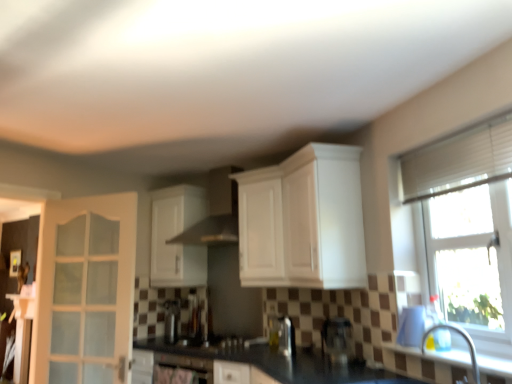
Question: Is black granite countertop at center surrounded by silver metallic faucet at lower right?

Choices:
 (A) no
 (B) yes

Answer: (A)

Question: Does silver metallic faucet at lower right have a larger size compared to black granite countertop at center?

Choices:
 (A) no
 (B) yes

Answer: (A)

Question: Is silver metallic faucet at lower right not inside black granite countertop at center?

Choices:
 (A) no
 (B) yes

Answer: (B)

Question: Is silver metallic faucet at lower right facing away from black granite countertop at center?

Choices:
 (A) yes
 (B) no

Answer: (B)

Question: Does silver metallic faucet at lower right lie behind black granite countertop at center?

Choices:
 (A) no
 (B) yes

Answer: (B)

Question: Choose the correct answer: Is black granite countertop at center inside white glass door at left or outside it?

Choices:
 (A) inside
 (B) outside

Answer: (B)

Question: In terms of width, does black granite countertop at center look wider or thinner when compared to white glass door at left?

Choices:
 (A) thin
 (B) wide

Answer: (B)

Question: Relative to white glass door at left, is black granite countertop at center in front or behind?

Choices:
 (A) front
 (B) behind

Answer: (A)

Question: In terms of height, does black granite countertop at center look taller or shorter compared to white glass door at left?

Choices:
 (A) short
 (B) tall

Answer: (A)

Question: Visually, is white glossy cabinet at upper center, the 1th cabinetry from the back, positioned to the left or to the right of black granite countertop at center?

Choices:
 (A) left
 (B) right

Answer: (A)

Question: From the image's perspective, relative to black granite countertop at center, is white glossy cabinet at upper center, marked as the 2th cabinetry in a right-to-left arrangement, above or below?

Choices:
 (A) above
 (B) below

Answer: (A)

Question: Is point (173, 187) positioned closer to the camera than point (411, 360)?

Choices:
 (A) closer
 (B) farther

Answer: (B)

Question: Do you think white glossy cabinet at upper center, the second cabinetry in the front-to-back sequence, is within black granite countertop at center, or outside of it?

Choices:
 (A) outside
 (B) inside

Answer: (A)

Question: Would you say transparent glass window at right is inside or outside silver metallic faucet at lower right?

Choices:
 (A) inside
 (B) outside

Answer: (B)

Question: From the image's perspective, relative to silver metallic faucet at lower right, is transparent glass window at right above or below?

Choices:
 (A) above
 (B) below

Answer: (A)